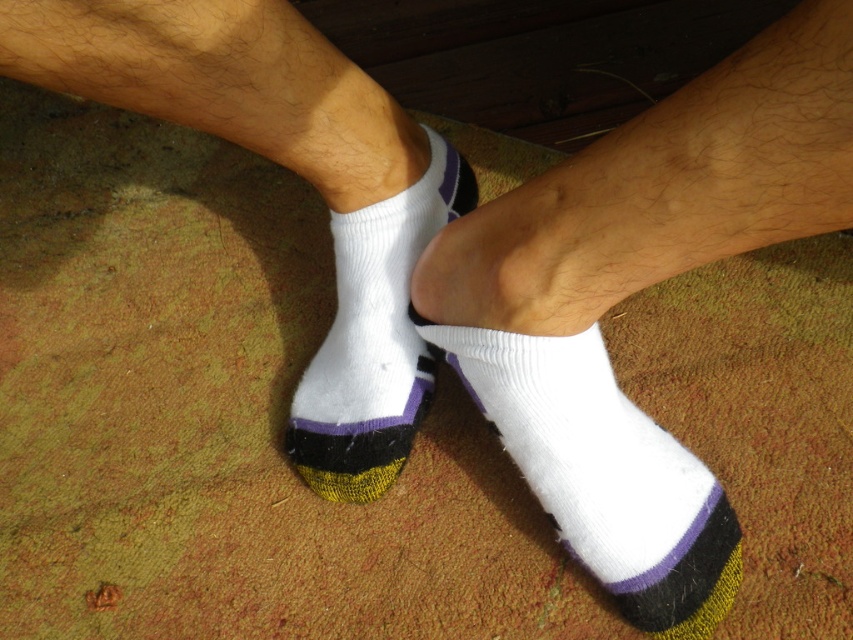
Is white knit sock at center smaller than white knitted sock at center?

Incorrect, white knit sock at center is not smaller in size than white knitted sock at center.

Is white knit sock at center shorter than white knitted sock at center?

Correct, white knit sock at center is not as tall as white knitted sock at center.

Which is in front, point (631, 556) or point (373, 284)?

Point (631, 556) is more forward.

Find the location of a particular element. The width and height of the screenshot is (853, 640). white knit sock at center is located at coordinates (604, 474).

Is point (393, 436) positioned in front of point (407, 220)?

No, it is behind (407, 220).

Who is shorter, white knitted socks at center or white knitted sock at center?

With less height is white knitted sock at center.

Is point (393, 200) less distant than point (390, 307)?

Yes, it is in front of point (390, 307).

Identify the location of white knitted socks at center. This screenshot has height=640, width=853. (292, 170).

Is white fabric sock at center bigger than white knitted socks at center?

No, white fabric sock at center is not bigger than white knitted socks at center.

Who is more distant from viewer, (579,394) or (355,413)?

The point (355,413) is behind.

Between point (618, 397) and point (368, 90), which one is positioned in front?

Point (368, 90)

At what (x,y) coordinates should I click in order to perform the action: click on white fabric sock at center. Please return your answer as a coordinate pair (x, y). The image size is (853, 640). Looking at the image, I should click on point(636,291).